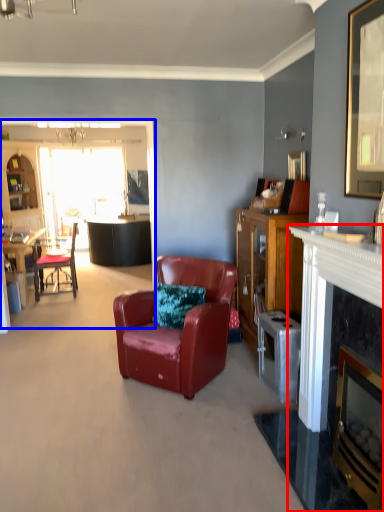
Question: Which of the following is the farthest to the observer, fireplace (highlighted by a red box) or entertainment center (highlighted by a blue box)?

Choices:
 (A) fireplace
 (B) entertainment center

Answer: (B)